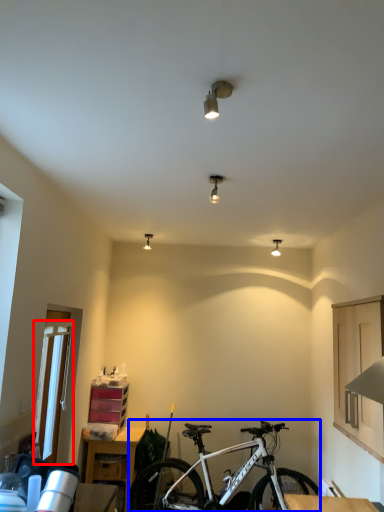
Question: Which object appears farthest to the camera in this image, glass door (highlighted by a red box) or bicycle (highlighted by a blue box)?

Choices:
 (A) glass door
 (B) bicycle

Answer: (B)